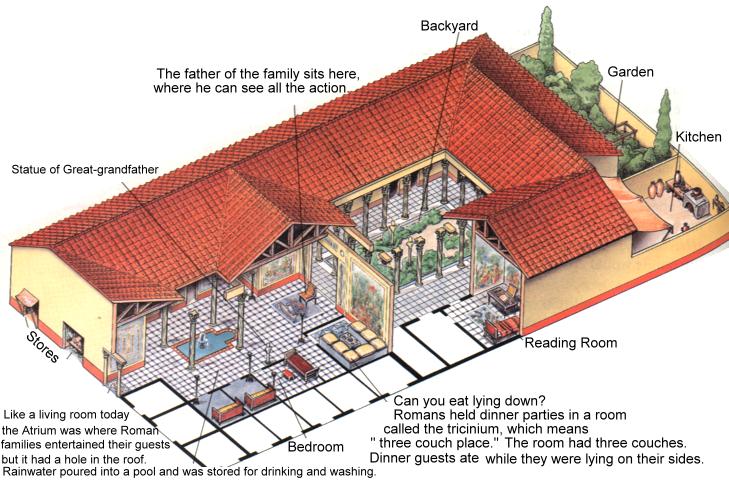
This screenshot has height=480, width=729. In order to click on 7 seating areas inside in this screenshot , I will do `click(259, 386)`, `click(235, 403)`, `click(300, 361)`, `click(335, 345)`, `click(510, 332)`, `click(504, 297)`, `click(305, 288)`.